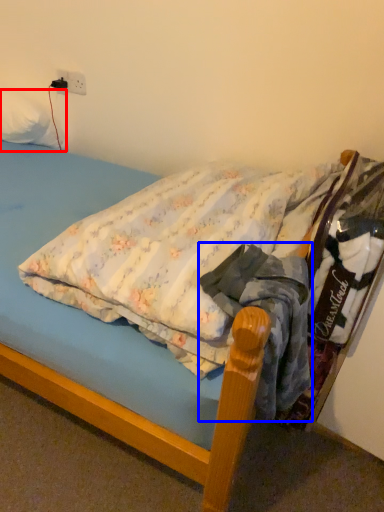
Question: Among these objects, which one is nearest to the camera, pillow (highlighted by a red box) or clothing (highlighted by a blue box)?

Choices:
 (A) pillow
 (B) clothing

Answer: (B)